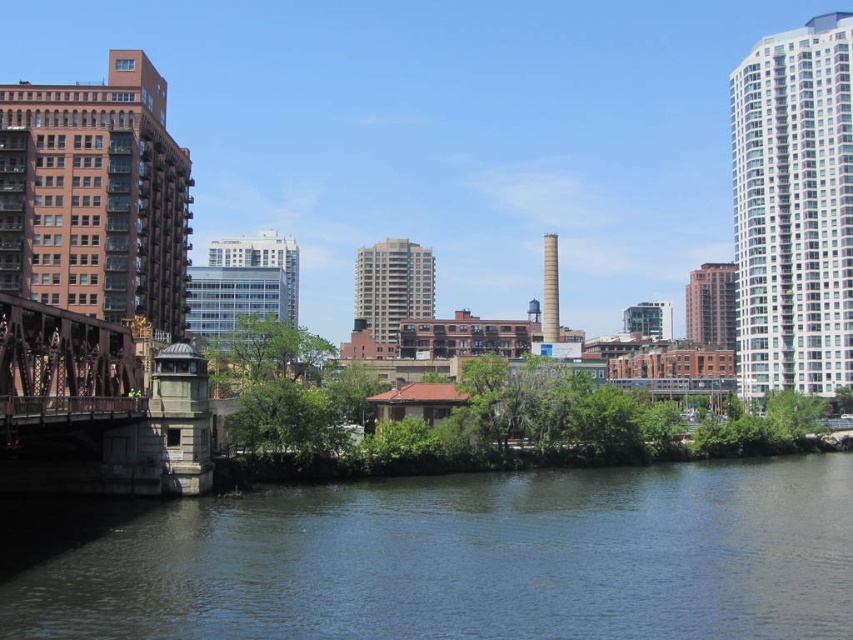
The height and width of the screenshot is (640, 853). What do you see at coordinates (471, 561) in the screenshot? I see `dark blue water at lower center` at bounding box center [471, 561].

Does dark blue water at lower center have a smaller size compared to rusty metal bridge at left?

No, dark blue water at lower center is not smaller than rusty metal bridge at left.

Does point (822, 492) come behind point (65, 392)?

Yes, point (822, 492) is farther from viewer.

Identify the location of dark blue water at lower center. (471, 561).